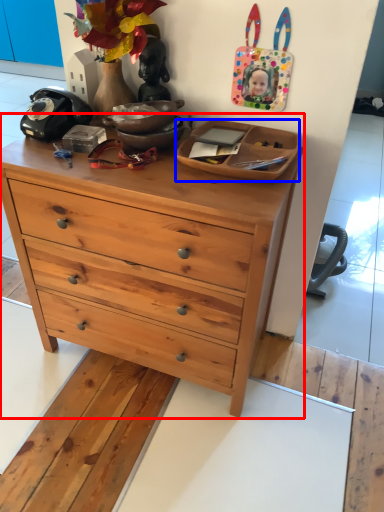
Question: Which object is further to the camera taking this photo, chest of drawers (highlighted by a red box) or cabinetry (highlighted by a blue box)?

Choices:
 (A) chest of drawers
 (B) cabinetry

Answer: (B)